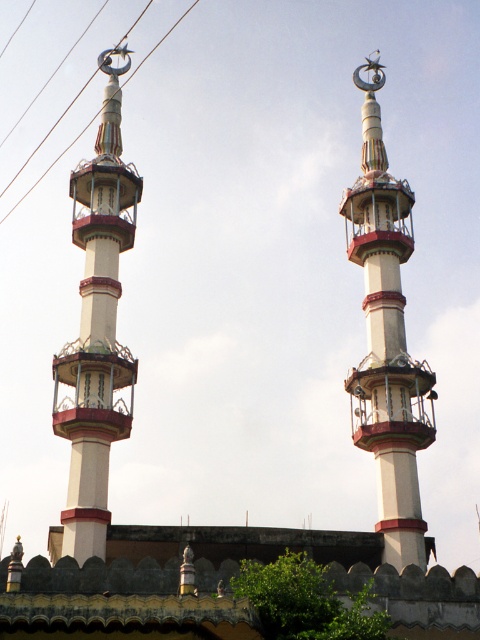
Question: Is white glossy minaret at center below metallic wire at upper center?

Choices:
 (A) no
 (B) yes

Answer: (B)

Question: Estimate the real-world distances between objects in this image. Which object is closer to the metallic wire at upper center?

Choices:
 (A) white painted metal minaret at left
 (B) white glossy minaret at center

Answer: (A)

Question: Can you confirm if white painted metal minaret at left is positioned below white glossy minaret at center?

Choices:
 (A) yes
 (B) no

Answer: (A)

Question: Does white painted metal minaret at left appear over metallic wire at upper center?

Choices:
 (A) yes
 (B) no

Answer: (B)

Question: Among these points, which one is farthest from the camera?

Choices:
 (A) (121, 36)
 (B) (78, 448)

Answer: (A)

Question: Which of these objects is positioned closest to the white painted metal minaret at left?

Choices:
 (A) white glossy minaret at center
 (B) metallic wire at upper center

Answer: (A)